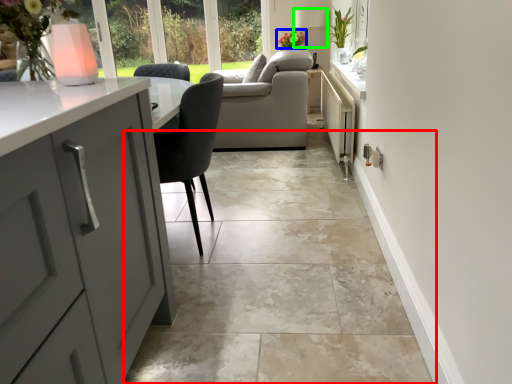
Question: Estimate the real-world distances between objects in this image. Which object is farther from ceramic tile (highlighted by a red box), flower (highlighted by a blue box) or lamp (highlighted by a green box)?

Choices:
 (A) flower
 (B) lamp

Answer: (B)